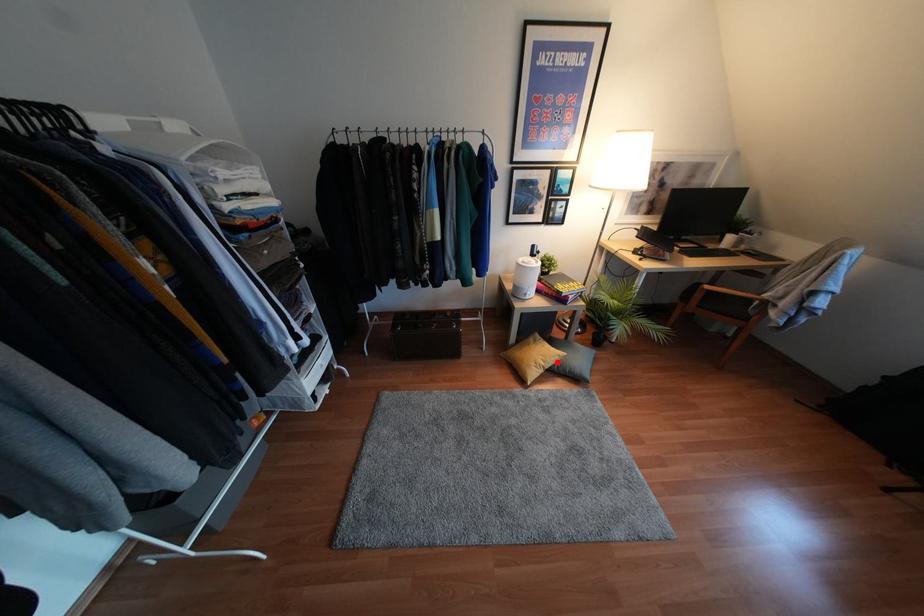
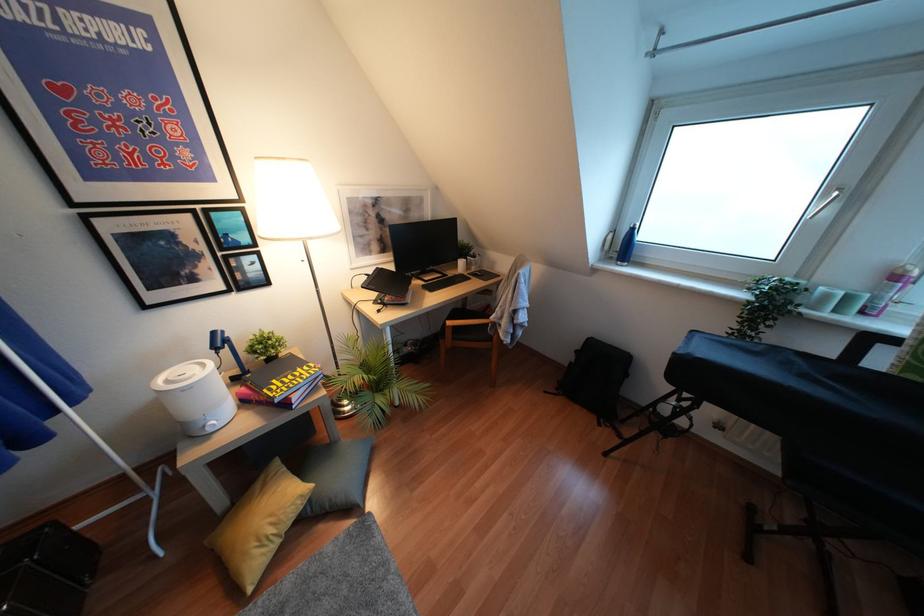
Question: I am providing you with two images of the same scene from different viewpoints. Image1 has a red point marked. In image2, the corresponding 3D location appears at what relative position? Reply with the corresponding letter.

Choices:
 (A) Closer
 (B) Farther

Answer: (B)